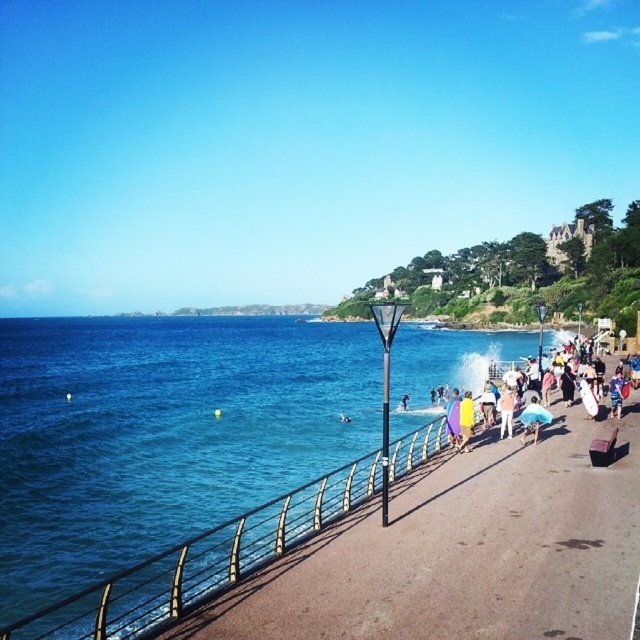
Question: Which of the following is the closest to the observer?

Choices:
 (A) yellow fabric umbrella at center
 (B) purple fabric at center
 (C) blue water at lower left
 (D) pink fabric dress at center

Answer: (C)

Question: Which point is farther to the camera?

Choices:
 (A) blue water at lower left
 (B) yellow fabric umbrella at center
 (C) purple fabric at center
 (D) light blue fabric umbrella at center-right

Answer: (C)

Question: Estimate the real-world distances between objects in this image. Which object is closer to the yellow fabric umbrella at center?

Choices:
 (A) pink fabric dress at center
 (B) light blue fabric umbrella at center-right
 (C) purple fabric at center

Answer: (A)

Question: In this image, where is light blue fabric umbrella at center-right located relative to pink fabric dress at center?

Choices:
 (A) above
 (B) below

Answer: (B)

Question: Does light blue fabric umbrella at center-right appear on the left side of purple fabric at center?

Choices:
 (A) yes
 (B) no

Answer: (B)

Question: Is blue water at lower left in front of yellow fabric umbrella at center?

Choices:
 (A) yes
 (B) no

Answer: (A)